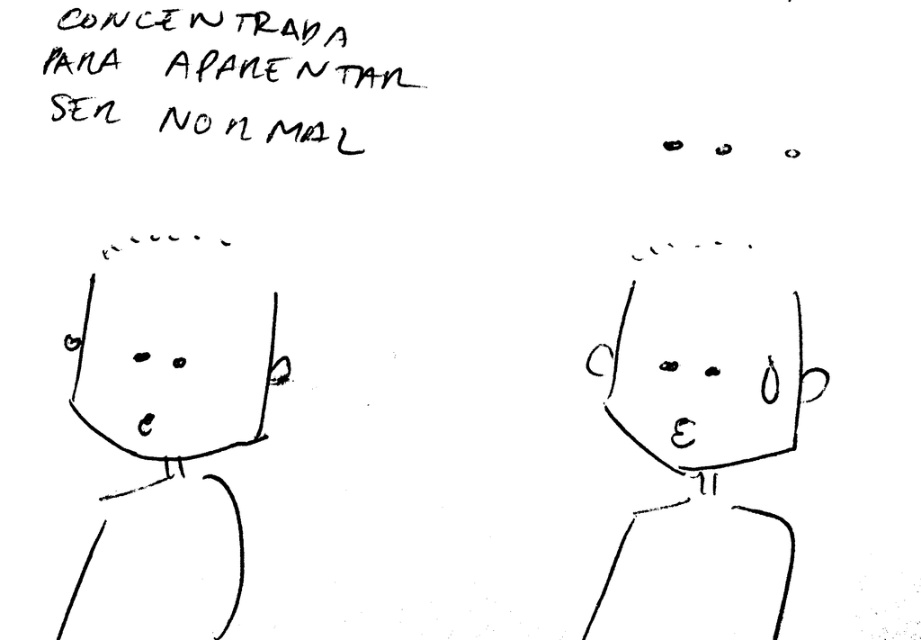
Does black line drawing face at left have a greater height compared to smooth black face at center?

No, black line drawing face at left is not taller than smooth black face at center.

Describe the element at coordinates (175, 352) in the screenshot. I see `black line drawing face at left` at that location.

I want to click on black line drawing face at left, so click(175, 352).